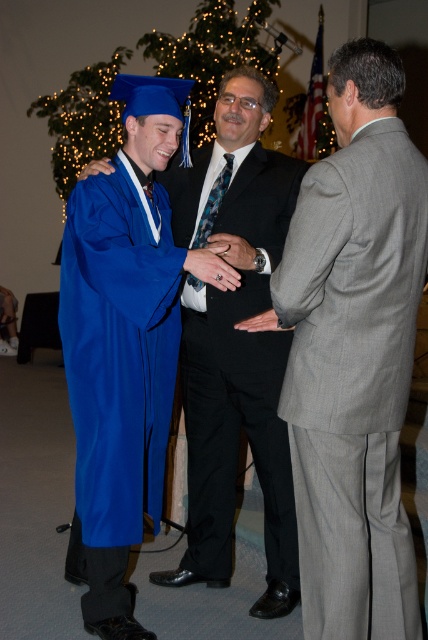
Who is more forward, (347, 630) or (267, 348)?

Positioned in front is point (347, 630).

Is point (419, 220) closer to camera compared to point (232, 486)?

Yes, it is.

The height and width of the screenshot is (640, 428). I want to click on gray textured suit at right, so click(354, 353).

Does matte black suit at center appear on the right side of blue matte graduation gown at left?

Correct, you'll find matte black suit at center to the right of blue matte graduation gown at left.

Is the position of matte black suit at center more distant than that of blue matte graduation gown at left?

Yes, it is behind blue matte graduation gown at left.

What do you see at coordinates (234, 340) in the screenshot? I see `matte black suit at center` at bounding box center [234, 340].

You are a GUI agent. You are given a task and a screenshot of the screen. Output one action in this format:
    pyautogui.click(x=<x>, y=<y>)
    Task: Click on the matte black suit at center
    
    Given the screenshot: What is the action you would take?
    pyautogui.click(x=234, y=340)

Who is more distant from viewer, (287,310) or (79,580)?

The point (79,580) is behind.

Can you confirm if gray textured suit at right is thinner than blue matte graduation gown at left?

No, gray textured suit at right is not thinner than blue matte graduation gown at left.

At what (x,y) coordinates should I click in order to perform the action: click on gray textured suit at right. Please return your answer as a coordinate pair (x, y). The image size is (428, 640). Looking at the image, I should click on 354,353.